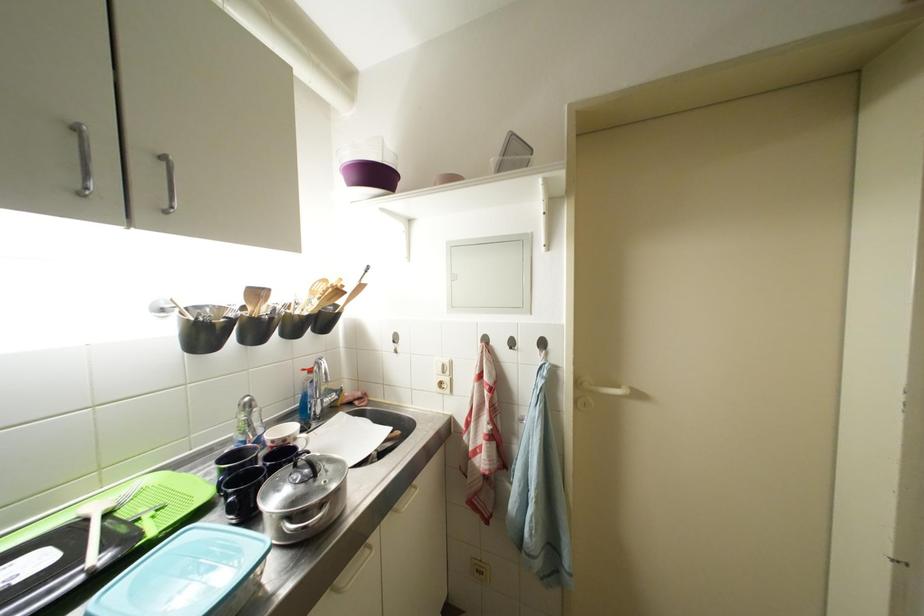
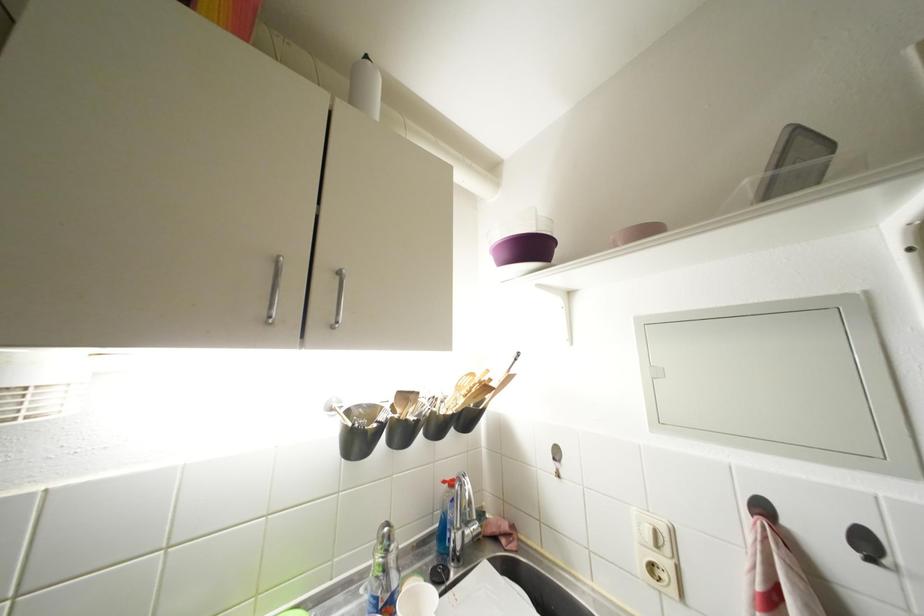
Where in the second image is the point corresponding to pixel 450 376 from the first image?

(663, 549)